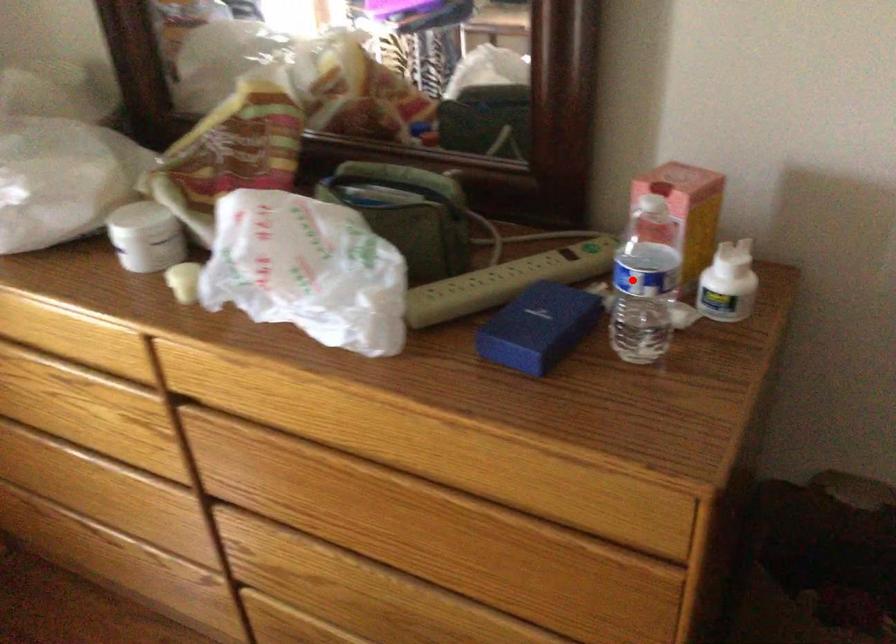
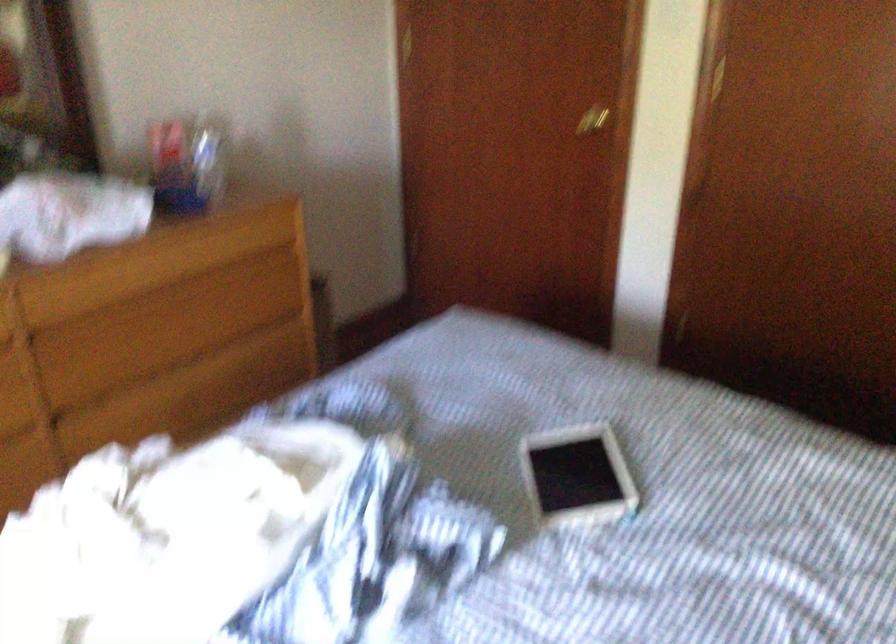
Question: I am providing you with two images of the same scene from different viewpoints. In image1, a red point is highlighted. Considering the same 3D point in image2, which of the following is correct?

Choices:
 (A) It is closer
 (B) It is farther

Answer: (B)